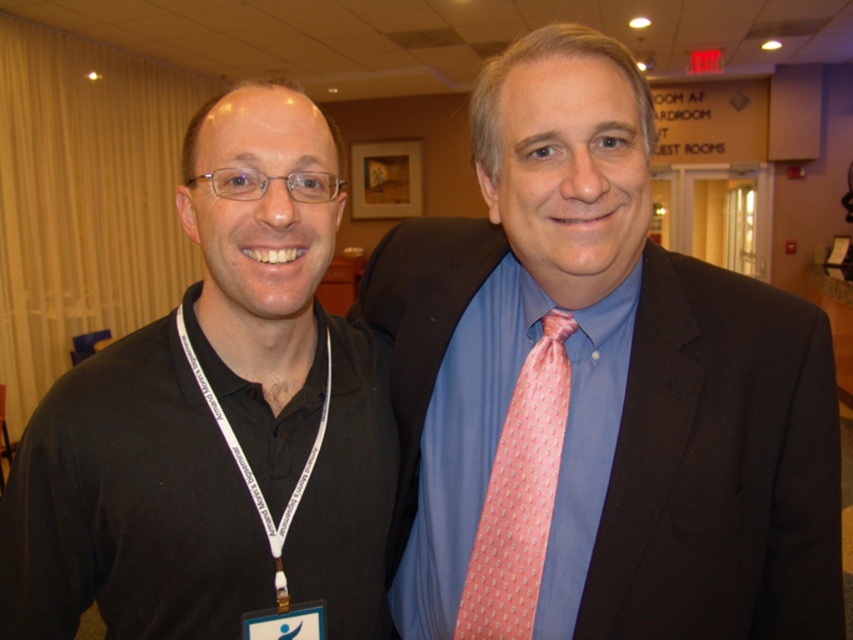
Question: Which of the following is the farthest from the observer?

Choices:
 (A) pink dotted tie at center
 (B) pink silk tie at center
 (C) black lanyard at left

Answer: (B)

Question: Which object appears farthest from the camera in this image?

Choices:
 (A) pink dotted tie at center
 (B) pink silk tie at center
 (C) black lanyard at left

Answer: (B)

Question: Considering the real-world distances, which object is farthest from the pink silk tie at center?

Choices:
 (A) pink dotted tie at center
 (B) black lanyard at left

Answer: (B)

Question: Does pink dotted tie at center appear over black lanyard at left?

Choices:
 (A) yes
 (B) no

Answer: (B)

Question: Does black lanyard at left appear on the left side of pink silk tie at center?

Choices:
 (A) yes
 (B) no

Answer: (A)

Question: Is pink dotted tie at center bigger than black lanyard at left?

Choices:
 (A) no
 (B) yes

Answer: (B)